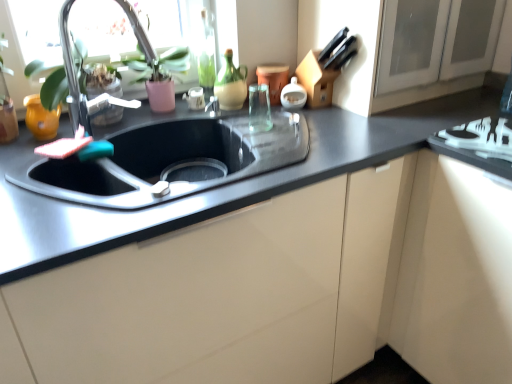
What are the coordinates of `matte yellow vase at left, marked as the 1th appliance in a left-to-right arrangement` in the screenshot? It's located at 41,118.

Image resolution: width=512 pixels, height=384 pixels. What do you see at coordinates (195, 98) in the screenshot?
I see `white glossy coffee cup at center, arranged as the 3th appliance when viewed from the right` at bounding box center [195, 98].

This screenshot has height=384, width=512. I want to click on black granite countertop at center, so click(222, 187).

Measure the distance between point (87, 43) and camera.

Point (87, 43) and camera are 4.49 feet apart from each other.

Describe the element at coordinates (29, 41) in the screenshot. I see `matte glass window screen at upper left` at that location.

At what (x,y) coordinates should I click in order to perform the action: click on white glossy soap dispenser at upper center, acting as the 1th appliance starting from the right. Please return your answer as a coordinate pair (x, y). Image resolution: width=512 pixels, height=384 pixels. Looking at the image, I should click on (293, 95).

Identify the location of matte yellow vase at left, marked as the 1th appliance in a left-to-right arrangement. This screenshot has width=512, height=384. (41, 118).

From a real-world perspective, which object stands above the other?

white glossy soap dispenser at upper center, acting as the 1th appliance starting from the right.

Consider the image. Is white glossy soap dispenser at upper center, acting as the 1th appliance starting from the right, with white glossy coffee cup at center, arranged as the 3th appliance when viewed from the right?

No, white glossy soap dispenser at upper center, acting as the 1th appliance starting from the right, is not touching white glossy coffee cup at center, arranged as the 3th appliance when viewed from the right.

Looking at this image, who is more distant, white glossy soap dispenser at upper center, acting as the 1th appliance starting from the right, or white glossy coffee cup at center, the second appliance positioned from the left?

white glossy coffee cup at center, the second appliance positioned from the left, is further away from the camera.

Is point (91, 14) more distant than point (387, 153)?

Yes.

Based on the photo, does matte glass window screen at upper left have a greater width compared to black granite countertop at center?

Incorrect, the width of matte glass window screen at upper left does not surpass that of black granite countertop at center.

Is matte glass window screen at upper left shorter than black granite countertop at center?

No.

Is black granite countertop at center oriented towards white glossy soap dispenser at upper center, acting as the 1th appliance starting from the right?

No, black granite countertop at center is not facing towards white glossy soap dispenser at upper center, acting as the 1th appliance starting from the right.

From a real-world perspective, is black granite countertop at center over white glossy soap dispenser at upper center, acting as the 1th appliance starting from the right?

No, from a real-world perspective, black granite countertop at center is not above white glossy soap dispenser at upper center, acting as the 1th appliance starting from the right.

From the image's perspective, which is below, black granite countertop at center or white glossy soap dispenser at upper center, acting as the 1th appliance starting from the right?

black granite countertop at center.

Measure the distance between black granite countertop at center and white glossy soap dispenser at upper center, acting as the 1th appliance starting from the right.

They are 19.37 inches apart.

Does white glossy coffee cup at center, arranged as the 3th appliance when viewed from the right, have a lesser height compared to black granite countertop at center?

Correct, white glossy coffee cup at center, arranged as the 3th appliance when viewed from the right, is not as tall as black granite countertop at center.

In the scene shown: Would you say white glossy coffee cup at center, arranged as the 3th appliance when viewed from the right, is outside black granite countertop at center?

That's correct, white glossy coffee cup at center, arranged as the 3th appliance when viewed from the right, is outside of black granite countertop at center.

Who is more distant, white glossy coffee cup at center, the second appliance positioned from the left, or black granite countertop at center?

Positioned behind is white glossy coffee cup at center, the second appliance positioned from the left.

Is white glossy coffee cup at center, arranged as the 3th appliance when viewed from the right, facing towards black granite countertop at center?

Yes, white glossy coffee cup at center, arranged as the 3th appliance when viewed from the right, is facing black granite countertop at center.

How many degrees apart are the facing directions of matte ceramic cup at upper center, the third appliance viewed from the left, and white glossy soap dispenser at upper center, acting as the 1th appliance starting from the right?

The angular difference between matte ceramic cup at upper center, the third appliance viewed from the left, and white glossy soap dispenser at upper center, acting as the 1th appliance starting from the right, is 0.00193 degrees.

Can you confirm if matte ceramic cup at upper center, which appears as the second appliance when viewed from the right, is positioned to the right of white glossy soap dispenser at upper center, which is the 4th appliance from left to right?

No.

Would you say matte ceramic cup at upper center, the third appliance viewed from the left, is a long distance from white glossy soap dispenser at upper center, acting as the 1th appliance starting from the right?

matte ceramic cup at upper center, the third appliance viewed from the left, is near white glossy soap dispenser at upper center, acting as the 1th appliance starting from the right, not far away.

In the scene shown: Is matte ceramic cup at upper center, the third appliance viewed from the left, positioned with its back to white glossy soap dispenser at upper center, acting as the 1th appliance starting from the right?

No, matte ceramic cup at upper center, the third appliance viewed from the left, is not facing away from white glossy soap dispenser at upper center, acting as the 1th appliance starting from the right.

From the image's perspective, which object appears higher, matte yellow vase at left, arranged as the fourth appliance when viewed from the right, or matte white cabinet at center?

matte yellow vase at left, arranged as the fourth appliance when viewed from the right, appears higher in the image.

From a real-world perspective, is matte yellow vase at left, arranged as the fourth appliance when viewed from the right, above or below matte white cabinet at center?

matte yellow vase at left, arranged as the fourth appliance when viewed from the right, is above matte white cabinet at center.

Considering the relative positions of matte yellow vase at left, arranged as the fourth appliance when viewed from the right, and matte white cabinet at center in the image provided, is matte yellow vase at left, arranged as the fourth appliance when viewed from the right, to the left of matte white cabinet at center from the viewer's perspective?

Indeed, matte yellow vase at left, arranged as the fourth appliance when viewed from the right, is positioned on the left side of matte white cabinet at center.

Between matte yellow vase at left, marked as the 1th appliance in a left-to-right arrangement, and matte white cabinet at center, which one has smaller size?

matte yellow vase at left, marked as the 1th appliance in a left-to-right arrangement, is smaller.

What are the coordinates of `cabinetry beneath the matte glass window screen at upper left (from a real-world perspective)` in the screenshot? It's located at (288, 289).

From the image's perspective, which one is positioned higher, matte white cabinet at center or matte glass window screen at upper left?

matte glass window screen at upper left appears higher in the image.

Who is taller, matte white cabinet at center or matte glass window screen at upper left?

With more height is matte white cabinet at center.

From a real-world perspective, which appliance is the 2nd one underneath the white glossy soap dispenser at upper center, acting as the 1th appliance starting from the right? Please provide its 2D coordinates.

[(195, 98)]

Locate an element on the screen. The image size is (512, 384). countertop lying below the matte glass window screen at upper left (from the image's perspective) is located at coordinates (222, 187).

Estimate the real-world distances between objects in this image. Which object is further from white glossy soap dispenser at upper center, which is the 4th appliance from left to right, matte white cabinet at center or matte glass window screen at upper left?

The object further to white glossy soap dispenser at upper center, which is the 4th appliance from left to right, is matte white cabinet at center.

Considering their positions, is matte glass window screen at upper left positioned closer to white glossy soap dispenser at upper center, acting as the 1th appliance starting from the right, than black granite countertop at center?

black granite countertop at center.

Estimate the real-world distances between objects in this image. Which object is further from matte white cabinet at center, matte yellow vase at left, arranged as the fourth appliance when viewed from the right, or black granite countertop at center?

matte yellow vase at left, arranged as the fourth appliance when viewed from the right, is positioned further to the anchor matte white cabinet at center.

Looking at the image, which one is located closer to white glossy coffee cup at center, arranged as the 3th appliance when viewed from the right, matte ceramic cup at upper center, which appears as the second appliance when viewed from the right, or black granite countertop at center?

Based on the image, matte ceramic cup at upper center, which appears as the second appliance when viewed from the right, appears to be nearer to white glossy coffee cup at center, arranged as the 3th appliance when viewed from the right.

From the image, which object appears to be nearer to matte glass window screen at upper left, matte yellow vase at left, arranged as the fourth appliance when viewed from the right, or white glossy soap dispenser at upper center, acting as the 1th appliance starting from the right?

matte yellow vase at left, arranged as the fourth appliance when viewed from the right, is closer to matte glass window screen at upper left.

Estimate the real-world distances between objects in this image. Which object is further from matte yellow vase at left, arranged as the fourth appliance when viewed from the right, white glossy coffee cup at center, the second appliance positioned from the left, or white glossy soap dispenser at upper center, which is the 4th appliance from left to right?

The object further to matte yellow vase at left, arranged as the fourth appliance when viewed from the right, is white glossy soap dispenser at upper center, which is the 4th appliance from left to right.

Which object lies nearer to the anchor point matte glass window screen at upper left, matte white cabinet at center or white glossy stove at lower right?

matte white cabinet at center is closer to matte glass window screen at upper left.

Which object lies nearer to the anchor point white glossy stove at lower right, white glossy coffee cup at center, the second appliance positioned from the left, or white glossy soap dispenser at upper center, acting as the 1th appliance starting from the right?

white glossy soap dispenser at upper center, acting as the 1th appliance starting from the right, lies closer to white glossy stove at lower right than the other object.

The width and height of the screenshot is (512, 384). Identify the location of countertop between white glossy coffee cup at center, the second appliance positioned from the left, and white glossy stove at lower right, in the horizontal direction. (222, 187).

I want to click on cabinetry located between white glossy coffee cup at center, arranged as the 3th appliance when viewed from the right, and white glossy stove at lower right in the left-right direction, so click(288, 289).

Where is `countertop located between matte white cabinet at center and white glossy coffee cup at center, the second appliance positioned from the left, in the depth direction`? The height and width of the screenshot is (384, 512). countertop located between matte white cabinet at center and white glossy coffee cup at center, the second appliance positioned from the left, in the depth direction is located at coordinates (222, 187).

Find the location of a particular element. window screen positioned between black granite countertop at center and white glossy soap dispenser at upper center, which is the 4th appliance from left to right, from near to far is located at coordinates (29, 41).